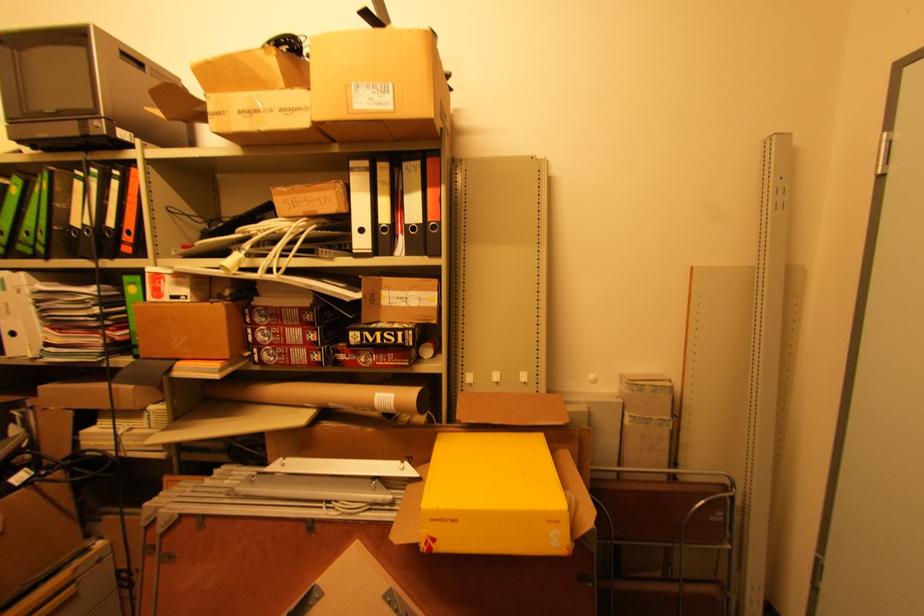
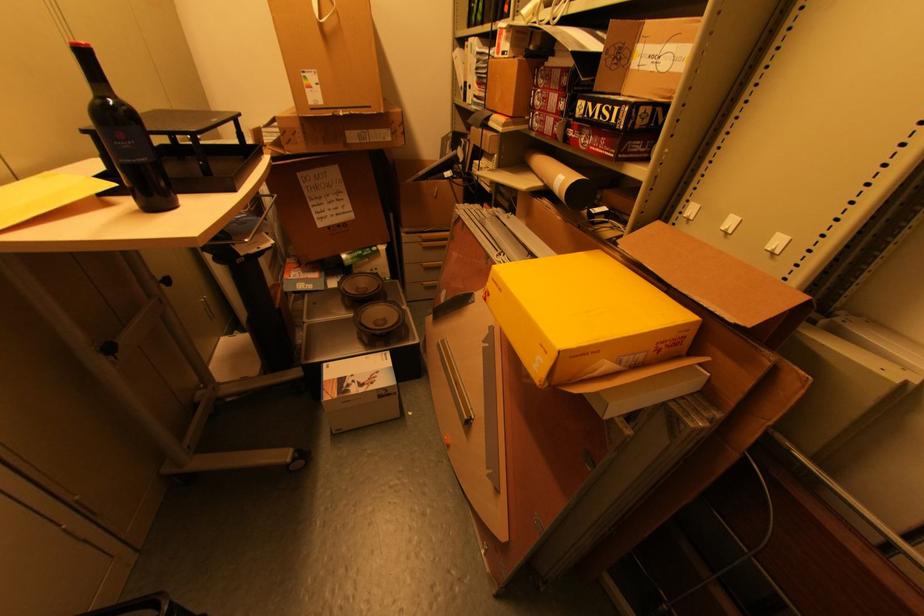
The point at (x=392, y=334) is marked in the first image. Where is the corresponding point in the second image?

(610, 108)